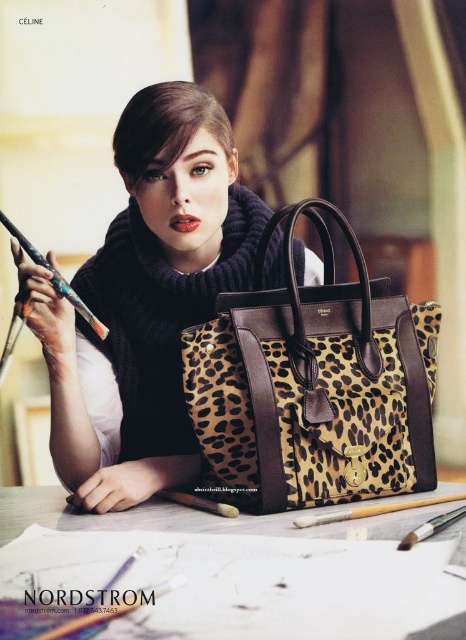
You are a delivery robot with a package that needs to be placed between the leather table at center and the wooden pencil at upper left. The package is 12 inches long. Will it fit in the space between them?

The distance between the leather table at center and the wooden pencil at upper left is 12.11 inches, so the package will fit as it is slightly shorter than the available space.

You are a delivery person who needs to place a small package on the table. The package is 12 inches long. Can you fit it on the table without overlapping the leather table at center?

The package is 12 inches long, and the distance between them is 17.64 inches. Since 12 inches is less than 17.64 inches, the package can fit on the table without overlapping the leather table at center.